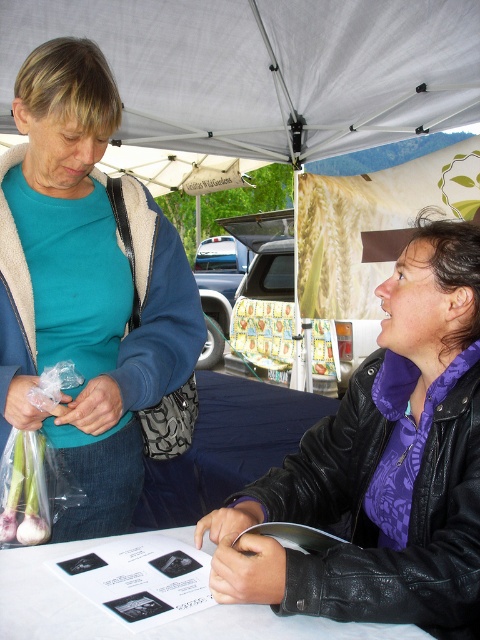
Question: Which object is closer to the camera taking this photo?

Choices:
 (A) white fabric canopy at upper center
 (B) matte teal shirt at left
 (C) purple leather jacket at center
 (D) white paper at center

Answer: (D)

Question: Is white fabric canopy at upper center to the left of white paper at center from the viewer's perspective?

Choices:
 (A) yes
 (B) no

Answer: (B)

Question: Estimate the real-world distances between objects in this image. Which object is closer to the white fabric canopy at upper center?

Choices:
 (A) matte teal shirt at left
 (B) white paper at center
 (C) purple leather jacket at center

Answer: (A)

Question: Can you confirm if purple leather jacket at center is smaller than white fabric canopy at upper center?

Choices:
 (A) yes
 (B) no

Answer: (A)

Question: Which point is farther to the camera?

Choices:
 (A) white fabric canopy at upper center
 (B) white paper at center

Answer: (A)

Question: Is white fabric canopy at upper center further to camera compared to white paper at center?

Choices:
 (A) yes
 (B) no

Answer: (A)